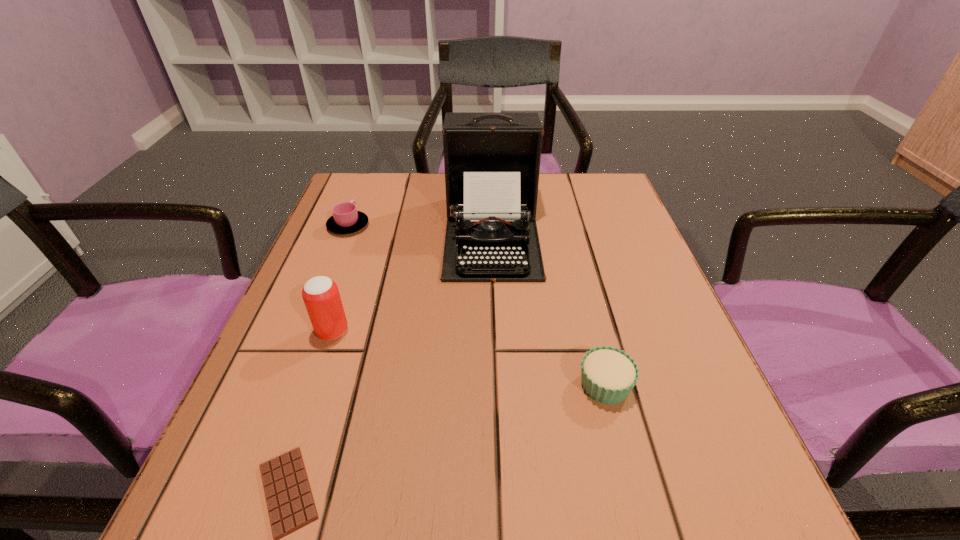
The image size is (960, 540). In the image, there is a desktop. Find the location of `vacant space at the near edge`. vacant space at the near edge is located at coordinates (334, 505).

This screenshot has height=540, width=960. I want to click on free space at the left edge of the desktop, so click(312, 259).

Image resolution: width=960 pixels, height=540 pixels. What are the coordinates of `vacant space at the right edge of the desktop` in the screenshot? It's located at (641, 315).

In the image, there is a desktop. Find the location of `free region at the far right corner`. free region at the far right corner is located at coordinates (559, 186).

Identify the location of empty space between the cup and the cupcake. (476, 305).

At what (x,y) coordinates should I click in order to perform the action: click on vacant area that lies between the second object from right to left and the cup. Please return your answer as a coordinate pair (x, y). The height and width of the screenshot is (540, 960). Looking at the image, I should click on (420, 230).

You are a GUI agent. You are given a task and a screenshot of the screen. Output one action in this format:
    pyautogui.click(x=<x>, y=<y>)
    Task: Click on the vacant space that's between the second nearest object and the typewriter
    The width and height of the screenshot is (960, 540).
    Given the screenshot: What is the action you would take?
    pyautogui.click(x=548, y=309)

Locate an element on the screen. vacant area that lies between the typewriter and the rightmost object is located at coordinates pos(548,309).

This screenshot has width=960, height=540. What are the coordinates of `vacant space in between the cup and the rightmost object` in the screenshot? It's located at (476, 305).

Identify which object is the third nearest to the rightmost object. Please provide its 2D coordinates. Your answer should be formatted as a tuple, i.e. [(x, y)], where the tuple contains the x and y coordinates of a point satisfying the conditions above.

[(320, 294)]